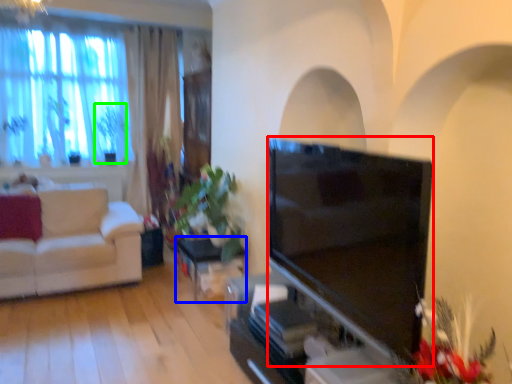
Question: Based on their relative distances, which object is farther from television (highlighted by a red box)? Choose from table (highlighted by a blue box) and plant (highlighted by a green box).

Choices:
 (A) table
 (B) plant

Answer: (B)